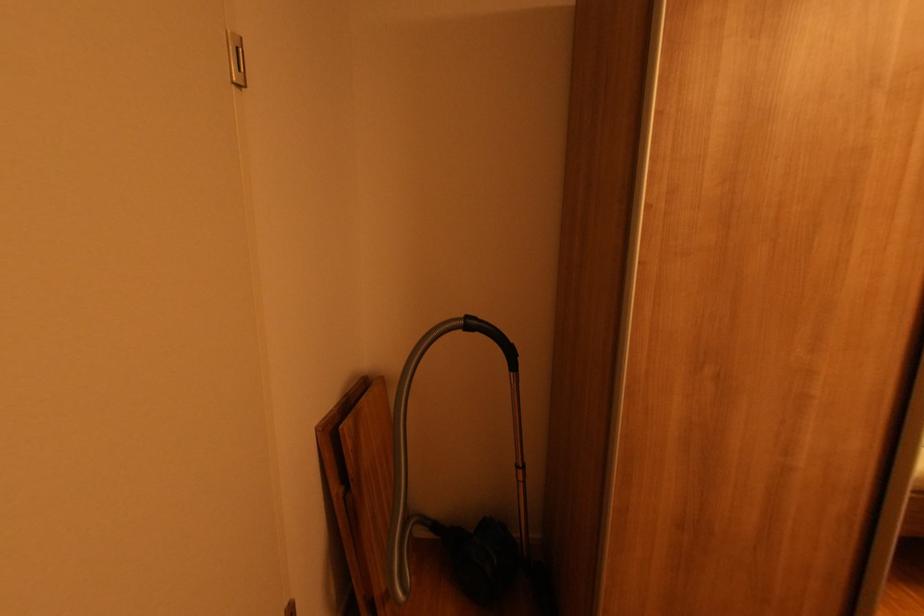
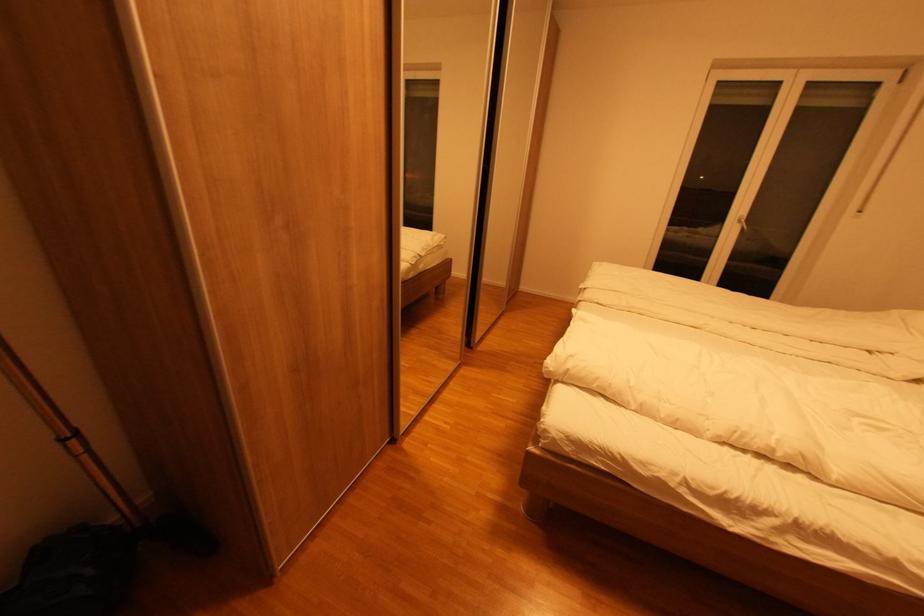
Based on the continuous images, in which direction is the camera rotating?

The rotation direction of the camera is right-down.